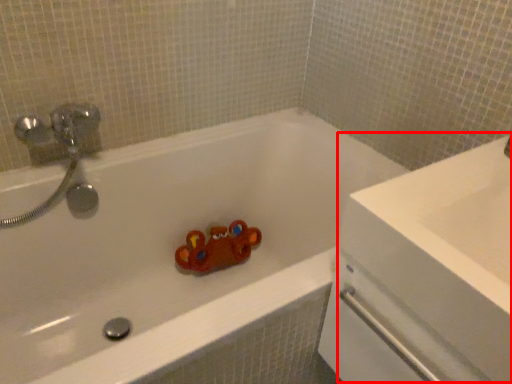
Question: From the image, what is the correct spatial relationship of counter top (annotated by the red box) in relation to bathtub?

Choices:
 (A) right
 (B) left

Answer: (A)